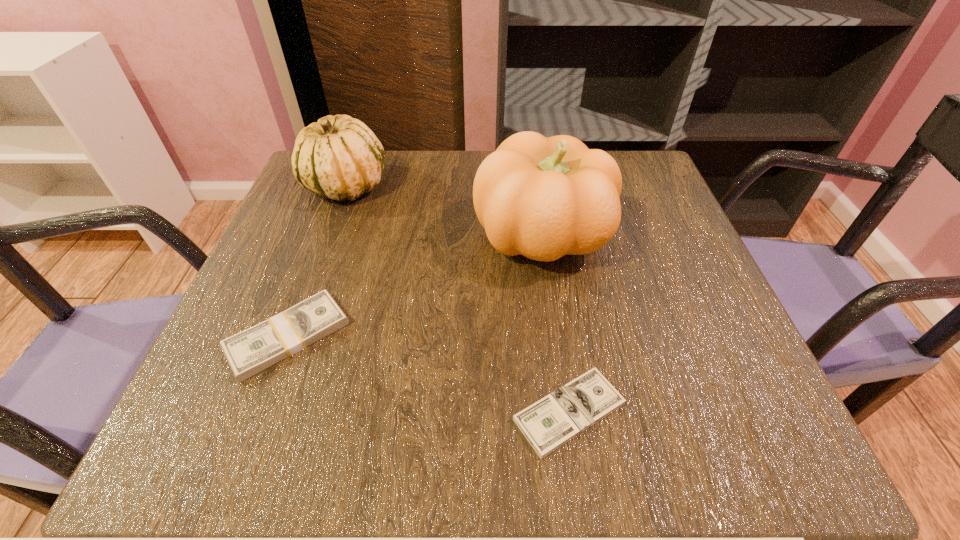
This screenshot has height=540, width=960. I want to click on pumpkin, so click(543, 198).

Identify the location of the second tallest object. The width and height of the screenshot is (960, 540). pyautogui.click(x=338, y=157).

Where is `the taller dollar`? the taller dollar is located at coordinates (253, 350).

Find the location of a particular element. Image resolution: width=960 pixels, height=540 pixels. the second shortest object is located at coordinates 253,350.

At what (x,y) coordinates should I click in order to perform the action: click on the shorter dollar. Please return your answer as a coordinate pair (x, y). The height and width of the screenshot is (540, 960). Looking at the image, I should click on (552, 421).

Find the location of a particular element. The width and height of the screenshot is (960, 540). the shortest object is located at coordinates (552, 421).

The width and height of the screenshot is (960, 540). Find the location of `vacant space located 0.140m on the left of the tallest object`. vacant space located 0.140m on the left of the tallest object is located at coordinates (406, 235).

Find the location of `vacant space located on the front of the gourd`. vacant space located on the front of the gourd is located at coordinates (324, 243).

Identify the location of vacant area situated on the back of the taller dollar. (347, 180).

Locate an element on the screen. free space located on the left of the shortest object is located at coordinates (314, 411).